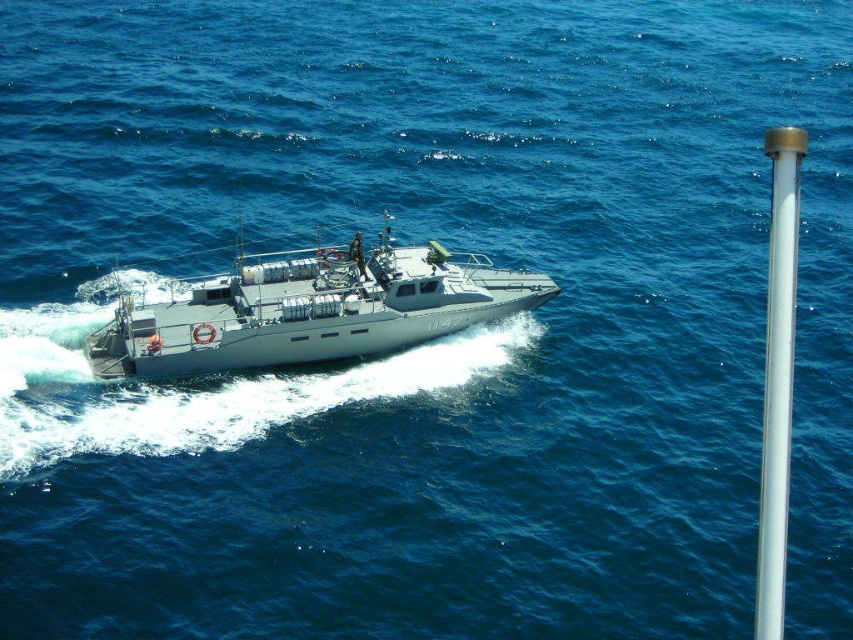
Question: In this image, where is gray matte boat at center located relative to white glossy pole at right?

Choices:
 (A) above
 (B) below

Answer: (B)

Question: Which of the following is the closest to the observer?

Choices:
 (A) (370, 324)
 (B) (782, 468)

Answer: (B)

Question: Can you confirm if gray matte boat at center is positioned to the left of white glossy pole at right?

Choices:
 (A) yes
 (B) no

Answer: (A)

Question: Does gray matte boat at center have a lesser width compared to white glossy pole at right?

Choices:
 (A) no
 (B) yes

Answer: (A)

Question: Among these objects, which one is nearest to the camera?

Choices:
 (A) gray matte boat at center
 (B) white glossy pole at right

Answer: (B)